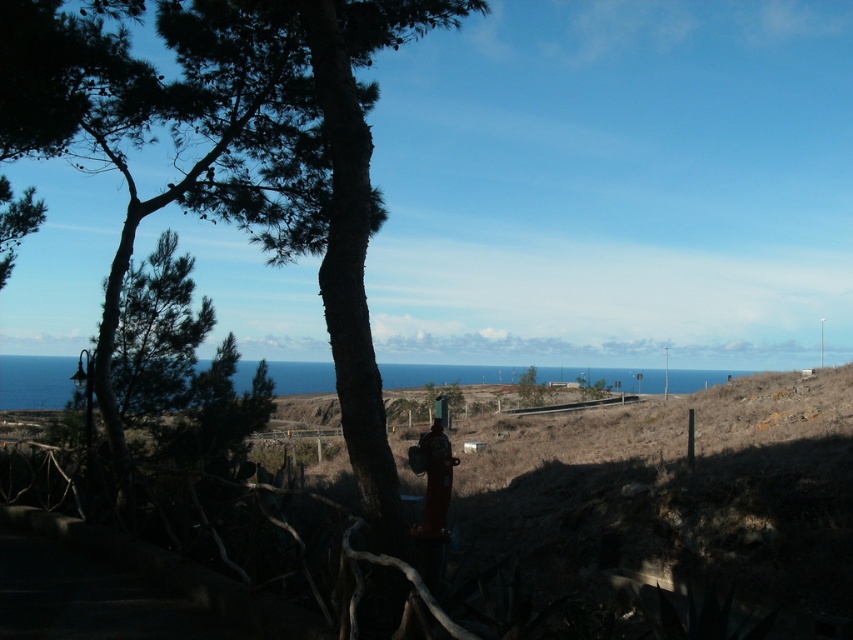
Question: Which of the following is the closest to the observer?

Choices:
 (A) (537, 400)
 (B) (445, 499)
 (C) (440, 365)

Answer: (B)

Question: Based on their relative distances, which object is nearer to the blue water at center?

Choices:
 (A) green leafy tree at center
 (B) matte brown jacket at center

Answer: (A)

Question: Does blue water at center have a lesser width compared to green leafy tree at center?

Choices:
 (A) yes
 (B) no

Answer: (B)

Question: Which point appears closest to the camera in this image?

Choices:
 (A) [x=521, y=394]
 (B) [x=421, y=444]
 (C) [x=672, y=392]

Answer: (B)

Question: Is blue water at center further to the viewer compared to matte brown jacket at center?

Choices:
 (A) yes
 (B) no

Answer: (A)

Question: Is matte brown jacket at center to the left of green leafy tree at center from the viewer's perspective?

Choices:
 (A) no
 (B) yes

Answer: (B)